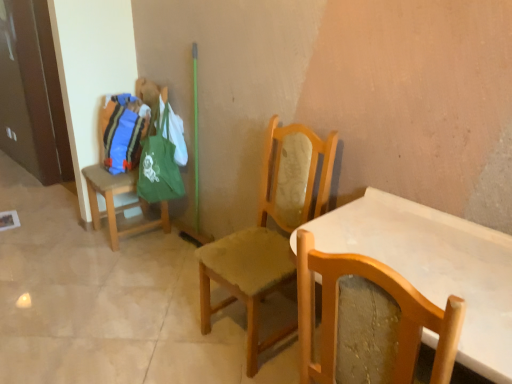
The width and height of the screenshot is (512, 384). What do you see at coordinates (269, 230) in the screenshot?
I see `wooden chair at center, the second chair from the front` at bounding box center [269, 230].

This screenshot has height=384, width=512. What do you see at coordinates (368, 321) in the screenshot?
I see `wooden chair at right, arranged as the third chair when viewed from the left` at bounding box center [368, 321].

The image size is (512, 384). What do you see at coordinates (113, 201) in the screenshot?
I see `wooden stool at left, acting as the 1th chair starting from the back` at bounding box center [113, 201].

Where is `wooden chair at center, arranged as the 2th chair when viewed from the right`? Image resolution: width=512 pixels, height=384 pixels. wooden chair at center, arranged as the 2th chair when viewed from the right is located at coordinates (269, 230).

Which is nearer, (98,213) or (368,274)?

The point (368,274) is closer.

Is wooden stool at left, which is the first chair in left-to-right order, smaller than wooden chair at right, which is the first chair in front-to-back order?

No, wooden stool at left, which is the first chair in left-to-right order, is not smaller than wooden chair at right, which is the first chair in front-to-back order.

Based on their positions, is wooden stool at left, which is the first chair in left-to-right order, located to the left or right of wooden chair at right, which ranks as the third chair in back-to-front order?

Based on their positions, wooden stool at left, which is the first chair in left-to-right order, is located to the left of wooden chair at right, which ranks as the third chair in back-to-front order.

Considering the positions of objects wooden chair at right, which ranks as the third chair in back-to-front order, and wooden chair at center, placed as the 2th chair when sorted from left to right, in the image provided, who is in front, wooden chair at right, which ranks as the third chair in back-to-front order, or wooden chair at center, placed as the 2th chair when sorted from left to right,?

wooden chair at right, which ranks as the third chair in back-to-front order.

From the image's perspective, which object appears higher, wooden chair at right, the 1th chair in the right-to-left sequence, or wooden chair at center, which ranks as the second chair in back-to-front order?

wooden chair at center, which ranks as the second chair in back-to-front order, is shown above in the image.

Which of these two, wooden chair at right, which is the first chair in front-to-back order, or wooden chair at center, which ranks as the second chair in back-to-front order, is thinner?

With smaller width is wooden chair at center, which ranks as the second chair in back-to-front order.

In the image, is wooden chair at center, which ranks as the second chair in back-to-front order, on the left side or the right side of wooden chair at right, which ranks as the third chair in back-to-front order?

From the image, it's evident that wooden chair at center, which ranks as the second chair in back-to-front order, is to the left of wooden chair at right, which ranks as the third chair in back-to-front order.

In the image, there is a wooden chair at center, which ranks as the second chair in back-to-front order. Where is `chair below it (from the image's perspective)`? chair below it (from the image's perspective) is located at coordinates (368, 321).

Are wooden chair at center, arranged as the 2th chair when viewed from the right, and wooden chair at right, the 1th chair in the right-to-left sequence, far apart?

That's not correct — wooden chair at center, arranged as the 2th chair when viewed from the right, is a little close to wooden chair at right, the 1th chair in the right-to-left sequence.

Considering the positions of points (209, 271) and (339, 344), is point (209, 271) farther from camera compared to point (339, 344)?

Yes, point (209, 271) is farther from viewer.

Is wooden chair at right, the 1th chair in the right-to-left sequence, to the left of wooden stool at left, acting as the third chair starting from the right, from the viewer's perspective?

In fact, wooden chair at right, the 1th chair in the right-to-left sequence, is to the right of wooden stool at left, acting as the third chair starting from the right.

From a real-world perspective, is wooden chair at right, which is the first chair in front-to-back order, on wooden stool at left, acting as the third chair starting from the right?

Correct, in the physical world, wooden chair at right, which is the first chair in front-to-back order, is higher than wooden stool at left, acting as the third chair starting from the right.

Would you say wooden stool at left, acting as the third chair starting from the right, is part of wooden chair at right, which ranks as the third chair in back-to-front order,'s contents?

Definitely not — wooden stool at left, acting as the third chair starting from the right, is not inside wooden chair at right, which ranks as the third chair in back-to-front order.

Does wooden chair at center, the second chair from the front, lie behind wooden stool at left, the third chair when ordered from front to back?

No, wooden chair at center, the second chair from the front, is closer to the camera.

From a real-world perspective, between wooden chair at center, arranged as the 2th chair when viewed from the right, and wooden stool at left, which is the first chair in left-to-right order, who is vertically lower?

wooden stool at left, which is the first chair in left-to-right order.

Measure the distance between wooden chair at center, placed as the 2th chair when sorted from left to right, and wooden stool at left, which is the first chair in left-to-right order.

A distance of 3.57 feet exists between wooden chair at center, placed as the 2th chair when sorted from left to right, and wooden stool at left, which is the first chair in left-to-right order.

Is wooden chair at center, placed as the 2th chair when sorted from left to right, to the left of wooden stool at left, which is the first chair in left-to-right order, from the viewer's perspective?

In fact, wooden chair at center, placed as the 2th chair when sorted from left to right, is to the right of wooden stool at left, which is the first chair in left-to-right order.

From a real-world perspective, is wooden stool at left, acting as the third chair starting from the right, over wooden chair at center, the second chair from the front?

No, from a real-world perspective, wooden stool at left, acting as the third chair starting from the right, is not over wooden chair at center, the second chair from the front

How many degrees apart are the facing directions of wooden stool at left, the third chair when ordered from front to back, and wooden chair at center, the second chair from the front?

There is a 2.81-degree angle between the facing directions of wooden stool at left, the third chair when ordered from front to back, and wooden chair at center, the second chair from the front.

Which object is positioned more to the left, wooden stool at left, acting as the 1th chair starting from the back, or wooden chair at center, which ranks as the second chair in back-to-front order?

wooden stool at left, acting as the 1th chair starting from the back.

From the wooden stool at left, the third chair when ordered from front to back, count 2nd chairs forward and point to it. Please provide its 2D coordinates.

[(368, 321)]

Locate an element on the screen. chair above the wooden chair at center, arranged as the 2th chair when viewed from the right (from a real-world perspective) is located at coordinates (368, 321).

From the image, which object appears to be nearer to wooden chair at right, the 1th chair in the right-to-left sequence, wooden chair at center, the second chair from the front, or wooden stool at left, the third chair when ordered from front to back?

Based on the image, wooden chair at center, the second chair from the front, appears to be nearer to wooden chair at right, the 1th chair in the right-to-left sequence.

From the image, which object appears to be nearer to wooden stool at left, acting as the 1th chair starting from the back, wooden chair at right, which is the first chair in front-to-back order, or wooden chair at center, arranged as the 2th chair when viewed from the right?

The object closer to wooden stool at left, acting as the 1th chair starting from the back, is wooden chair at center, arranged as the 2th chair when viewed from the right.

Looking at the image, which one is located closer to wooden chair at center, placed as the 2th chair when sorted from left to right, wooden stool at left, acting as the 1th chair starting from the back, or wooden chair at right, the 1th chair in the right-to-left sequence?

wooden chair at right, the 1th chair in the right-to-left sequence, is closer to wooden chair at center, placed as the 2th chair when sorted from left to right.

When comparing their distances from wooden chair at right, arranged as the third chair when viewed from the left, does wooden stool at left, acting as the 1th chair starting from the back, or wooden chair at center, which ranks as the second chair in back-to-front order, seem closer?

The object closer to wooden chair at right, arranged as the third chair when viewed from the left, is wooden chair at center, which ranks as the second chair in back-to-front order.

Which object lies further to the anchor point wooden stool at left, acting as the third chair starting from the right, wooden chair at center, the second chair from the front, or wooden chair at right, which is the first chair in front-to-back order?

wooden chair at right, which is the first chair in front-to-back order, is positioned further to the anchor wooden stool at left, acting as the third chair starting from the right.

Estimate the real-world distances between objects in this image. Which object is further from wooden chair at center, arranged as the 2th chair when viewed from the right, wooden chair at right, the 1th chair in the right-to-left sequence, or wooden stool at left, acting as the 1th chair starting from the back?

wooden stool at left, acting as the 1th chair starting from the back, is positioned further to the anchor wooden chair at center, arranged as the 2th chair when viewed from the right.

Where is `chair between wooden chair at right, which is the first chair in front-to-back order, and wooden stool at left, which is the first chair in left-to-right order, from front to back`? chair between wooden chair at right, which is the first chair in front-to-back order, and wooden stool at left, which is the first chair in left-to-right order, from front to back is located at coordinates (269, 230).